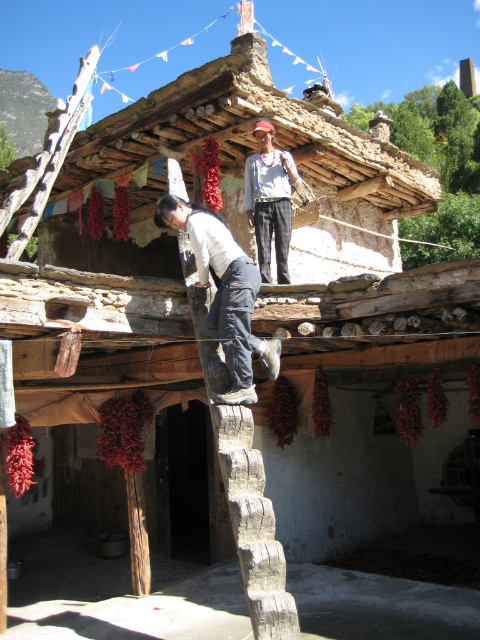
Can you confirm if rustic wooden roof at upper center is positioned to the right of white cotton shirt at upper center?

Yes, rustic wooden roof at upper center is to the right of white cotton shirt at upper center.

Does point (99, 138) lie behind point (253, 198)?

Yes, point (99, 138) is farther from viewer.

In order to click on rustic wooden roof at upper center in this screenshot , I will do `click(287, 106)`.

Does black matte pants at center appear over white cotton shirt at upper center?

Actually, black matte pants at center is below white cotton shirt at upper center.

The height and width of the screenshot is (640, 480). I want to click on black matte pants at center, so click(x=224, y=292).

Is rustic wooden roof at upper center bigger than black matte pants at center?

Yes.

Does rustic wooden roof at upper center come behind black matte pants at center?

Yes, it is behind black matte pants at center.

Is point (95, 147) positioned in front of point (162, 209)?

No.

Locate an element on the screen. This screenshot has height=640, width=480. rustic wooden roof at upper center is located at coordinates (287, 106).